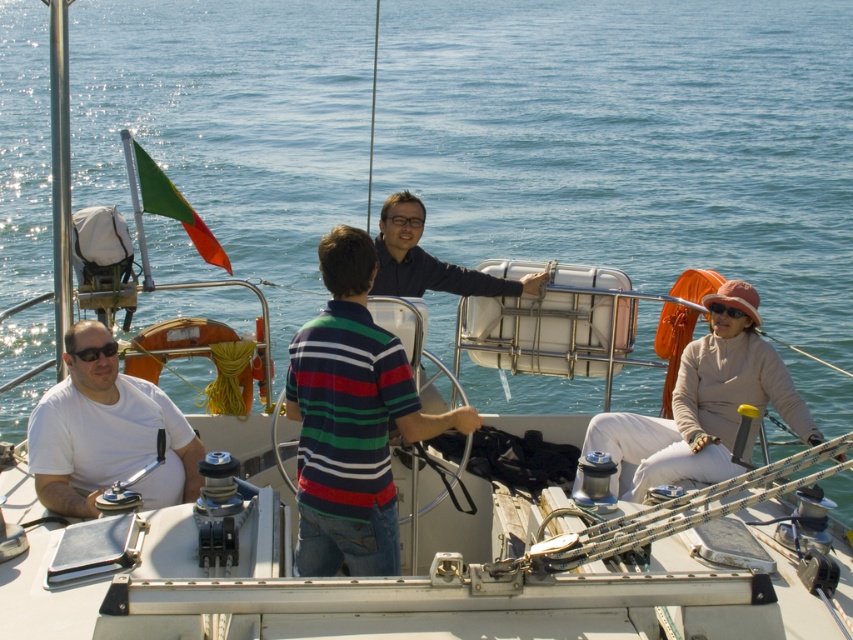
Question: Which of these objects is positioned farthest from the black plastic sunglasses at left?

Choices:
 (A) sunglasses at center
 (B) striped cotton shirt at center

Answer: (A)

Question: Is beige cotton sweater at right positioned before sunglasses at center?

Choices:
 (A) no
 (B) yes

Answer: (B)

Question: Which of these objects is positioned closest to the white matte shirt at left?

Choices:
 (A) striped cotton shirt at center
 (B) beige cotton sweater at right
 (C) black plastic sunglasses at left

Answer: (C)

Question: Among these points, which one is farthest from the camera?

Choices:
 (A) (734, 310)
 (B) (374, 406)
 (C) (108, 346)

Answer: (A)

Question: Can you confirm if striped cotton shirt at center is positioned below beige cotton sweater at right?

Choices:
 (A) no
 (B) yes

Answer: (A)

Question: Does black plastic sunglasses at left appear on the right side of sunglasses at center?

Choices:
 (A) yes
 (B) no

Answer: (B)